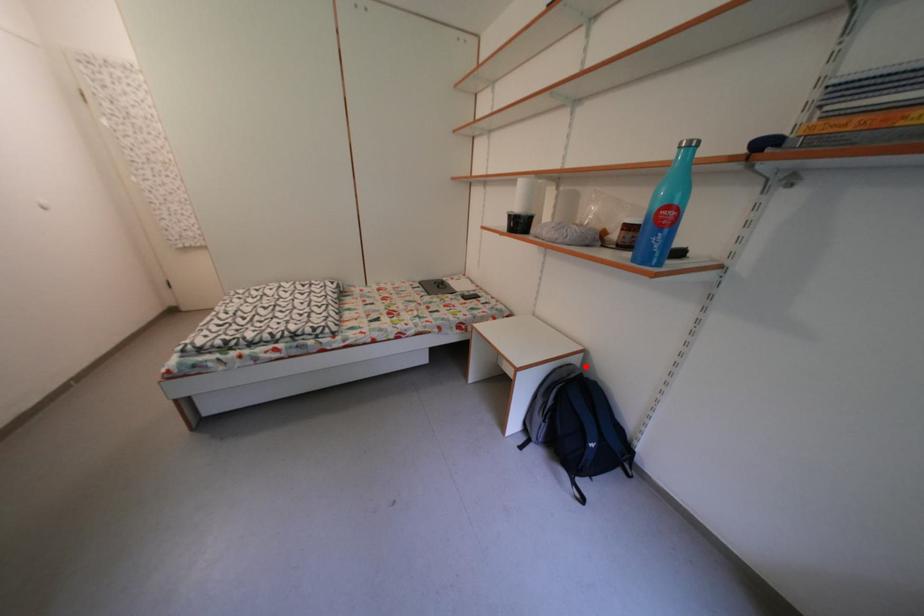
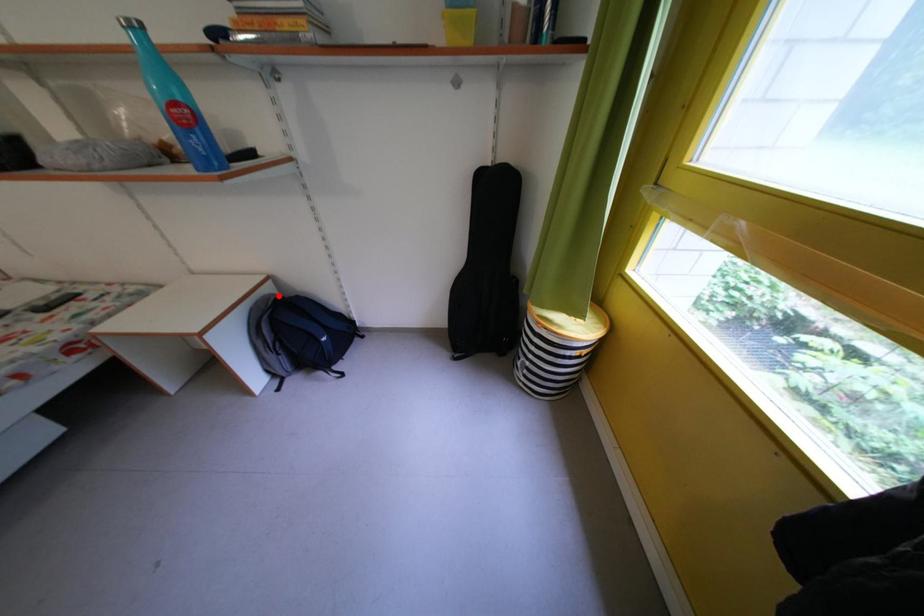
I am providing you with two images of the same scene from different viewpoints. A red point is marked on the first image and another point is marked on the second image. Are the points marked in image1 and image2 representing the same 3D position?

Yes